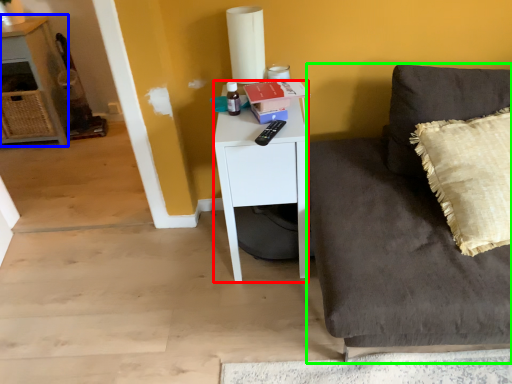
Question: Which object is the farthest from desk (highlighted by a red box)? Choose among these: cabinetry (highlighted by a blue box) or studio couch (highlighted by a green box).

Choices:
 (A) cabinetry
 (B) studio couch

Answer: (A)